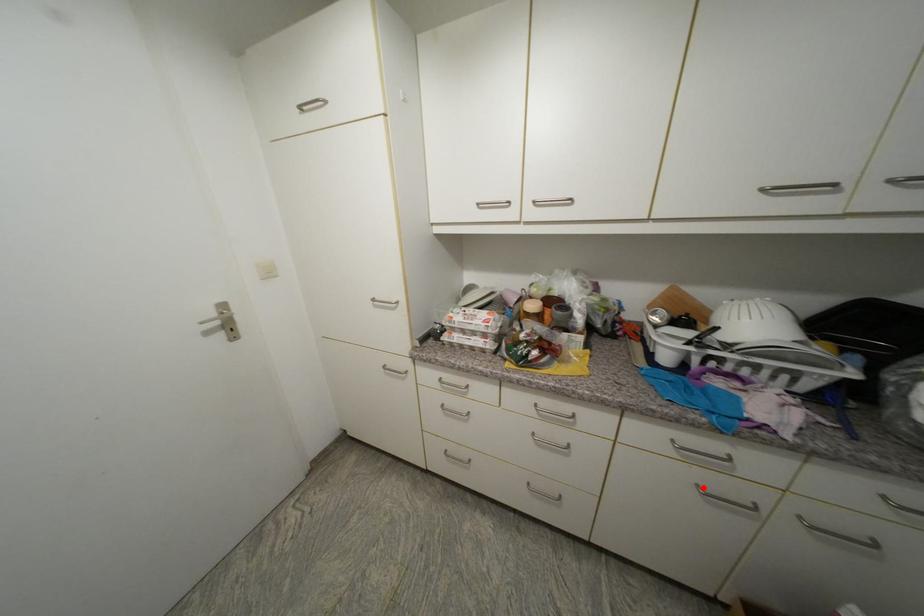
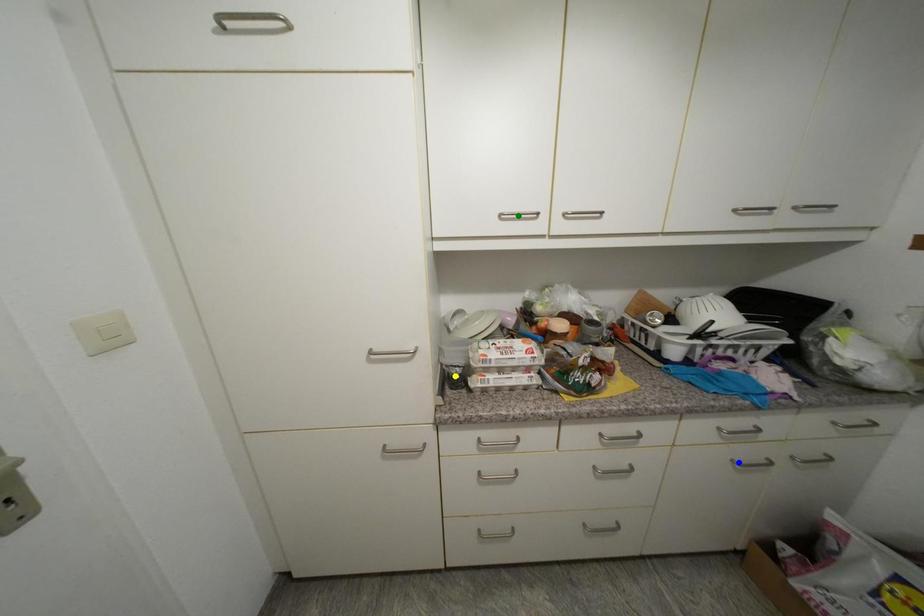
Question: I am providing you with two images of the same scene from different viewpoints. A red point is marked on the first image. You are given multiple points on the second image. Which point in image 2 is actually the same real-world point as the red point in image 1?

Choices:
 (A) blue point
 (B) green point
 (C) yellow point

Answer: (A)